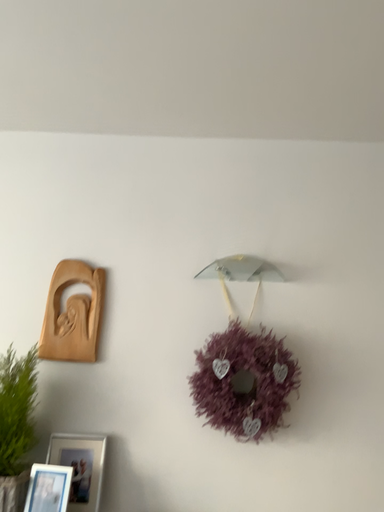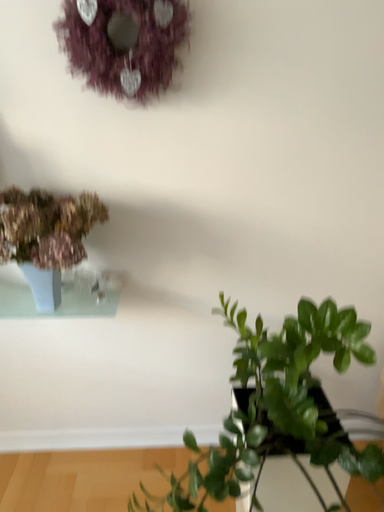
Question: Which way did the camera rotate in the video?

Choices:
 (A) rotated upward
 (B) rotated downward

Answer: (B)